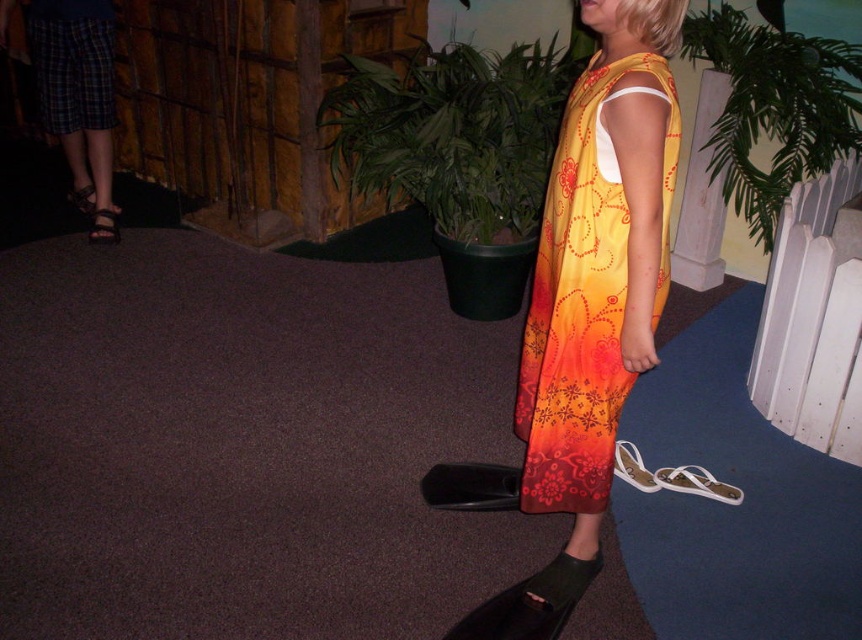
You are a photographer setting up a shoot in this room. You want to position a small stool between the green leafy plant at upper right and the plaid fabric skirt at left. Based on their positions, where should the stool be placed?

The stool should be placed between the green leafy plant at upper right and the plaid fabric skirt at left, but since the green leafy plant at upper right is located below the plaid fabric skirt at left, the stool needs to be positioned below the plaid fabric skirt at left and above the green leafy plant at upper right to be between them.

Based on the coordinates provided, which object is located at point (583,304) in the image?

The point (583,304) indicates the location of the floral print fabric dress at center.

You are a photographer positioned 2 meters away from the scene. You want to capture a closeup shot of the point at coordinates point (585, 129). Can you reach the point without moving closer than your current position?

The distance of point (585, 129) from camera is 1.46 meters, so yes, you can reach the point without moving closer since you are currently 2 meters away, which is farther than the point.